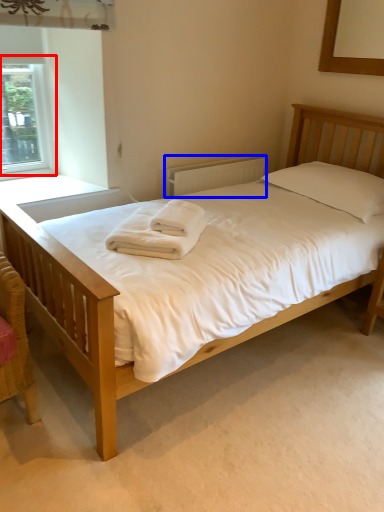
Question: Which point is further to the camera, window (highlighted by a red box) or radiator (highlighted by a blue box)?

Choices:
 (A) window
 (B) radiator

Answer: (B)